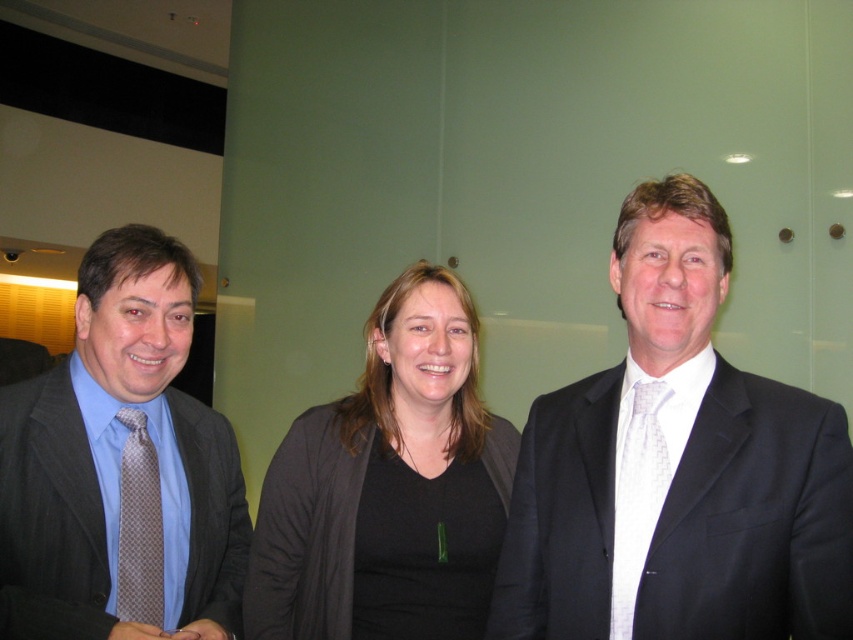
You are standing at the position of the viewer in the image and want to hand a document to the person wearing the dark gray suit at right. Can you reach them without moving closer?

The dark gray suit at right and viewer are 1.01 meters apart. Since the average human arm length is about 0.7 meters, you cannot reach them without moving closer.

In the scene shown: You are a photographer adjusting your camera settings to focus on the white textured tie at right. The camera has a focus point at coordinate point (636, 492). Is this focus point correctly positioned to capture the white textured tie at right?

Yes, the white textured tie at right is represented by point (636, 492), so the focus point at coordinate point (636, 492) is correctly positioned to capture the white textured tie at right.

You are organizing a photo shoot and need to ensure that the dark gray suit at right and the black matte cardigan at center are visible in the frame. Based on their sizes, which one might require more careful framing to avoid being cut off?

The dark gray suit at right is smaller than the black matte cardigan at center, so it might require more careful framing to avoid being cut off due to its smaller size.